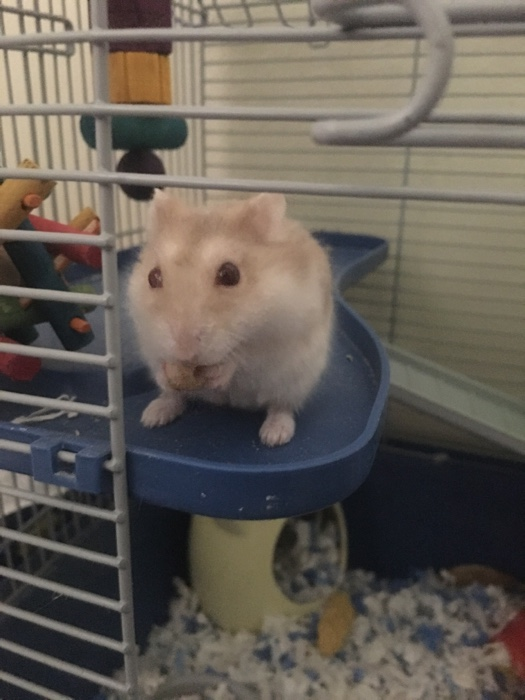
The height and width of the screenshot is (700, 525). Find the location of `multicolored toy`. multicolored toy is located at coordinates (56, 311), (55, 211), (12, 246).